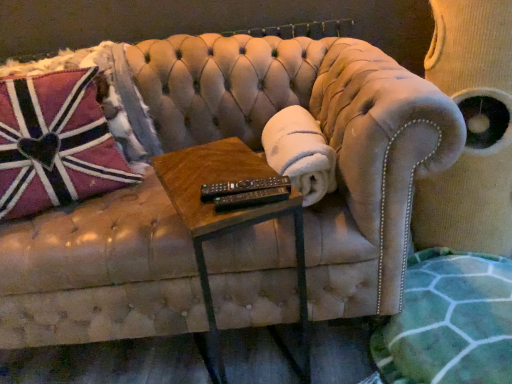
I want to click on black plastic remote at center, so click(242, 187).

What do you see at coordinates (231, 222) in the screenshot? The image size is (512, 384). I see `woodenmaterial/texturetable at center` at bounding box center [231, 222].

What do you see at coordinates (471, 130) in the screenshot?
I see `velvet swivel chair at upper right` at bounding box center [471, 130].

In order to face white fluffy blanket at center, should I rotate leftwards or rightwards?

Turn right approximately 5.311 degrees to face it.

Find the location of a particular element. black plastic remote at center is located at coordinates click(242, 187).

I want to click on swivel chair that is on the right side of pink plush pillow at left, so click(471, 130).

How many degrees apart are the facing directions of velvet swivel chair at upper right and pink plush pillow at left?

The angular difference between velvet swivel chair at upper right and pink plush pillow at left is 8.19 degrees.

From a real-world perspective, is velvet swivel chair at upper right positioned under pink plush pillow at left based on gravity?

Yes, from a real-world perspective, velvet swivel chair at upper right is below pink plush pillow at left.

Which point is more distant from viewer, [266,189] or [269,164]?

The point [269,164] is behind.

Considering the relative positions of black plastic remote at center and white fluffy blanket at center in the image provided, is black plastic remote at center in front of white fluffy blanket at center?

Yes, the depth of black plastic remote at center is less than that of white fluffy blanket at center.

Can you tell me how much black plastic remote at center and white fluffy blanket at center differ in facing direction?

The angle between the facing direction of black plastic remote at center and the facing direction of white fluffy blanket at center is 7.73 degrees.

Which of these two, black plastic remote at center or white fluffy blanket at center, is smaller?

black plastic remote at center.

From a real-world perspective, is black plastic remote at center above or below white fluffy blanket at center?

From a real-world perspective, black plastic remote at center is physically above white fluffy blanket at center.

How many degrees apart are the facing directions of black plastic remote at center and white fluffy blanket at center?

There is a 0.466-degree angle between the facing directions of black plastic remote at center and white fluffy blanket at center.

Does point (221, 185) lie behind point (330, 180)?

No, (221, 185) is in front of (330, 180).

Is black plastic remote at center spatially inside white fluffy blanket at center, or outside of it?

black plastic remote at center lies outside white fluffy blanket at center.

Is point (476, 222) farther from viewer compared to point (276, 192)?

Yes, point (476, 222) is farther from viewer.

Consider the image. Relative to black plastic remote at center, is velvet swivel chair at upper right in front or behind?

velvet swivel chair at upper right is behind black plastic remote at center.

Identify the location of remote in front of the velvet swivel chair at upper right. This screenshot has height=384, width=512. [x=251, y=198].

From the image's perspective, is velvet swivel chair at upper right on black plastic remote at center?

Yes, from the image's perspective, velvet swivel chair at upper right is over black plastic remote at center.

From the image's perspective, between black plastic remote at center and pink plush pillow at left, who is located below?

black plastic remote at center is shown below in the image.

Between black plastic remote at center and pink plush pillow at left, which one is positioned in front?

black plastic remote at center is in front.

From a real-world perspective, who is located higher, black plastic remote at center or pink plush pillow at left?

black plastic remote at center.

Considering the sizes of black plastic remote at center and pink plush pillow at left in the image, is black plastic remote at center bigger or smaller than pink plush pillow at left?

Clearly, black plastic remote at center is smaller in size than pink plush pillow at left.

Locate an element on the screen. This screenshot has width=512, height=384. swivel chair that is on the right side of white fluffy blanket at center is located at coordinates (471, 130).

From a real-world perspective, which object rests below the other?

In real-world perspective, velvet swivel chair at upper right is lower.

From the image's perspective, does white fluffy blanket at center appear lower than velvet swivel chair at upper right?

Yes.

Between pink plush pillow at left and white fluffy blanket at center, which one is positioned behind?

Positioned behind is pink plush pillow at left.

Who is shorter, pink plush pillow at left or white fluffy blanket at center?

white fluffy blanket at center.

Which is in front, point (4, 156) or point (318, 152)?

The point (318, 152) is more forward.

Does pink plush pillow at left have a lesser width compared to white fluffy blanket at center?

In fact, pink plush pillow at left might be wider than white fluffy blanket at center.

Find the location of a particular element. throw pillow above the velvet swivel chair at upper right (from a real-world perspective) is located at coordinates (55, 144).

The height and width of the screenshot is (384, 512). In order to click on material behind the black plastic remote at center in this screenshot , I will do `click(300, 153)`.

When comparing their distances from black plastic remote at center, does green textured blanket at lower right or black plastic remote at center seem further?

green textured blanket at lower right is positioned further to the anchor black plastic remote at center.

Based on their spatial positions, is velvet swivel chair at upper right or woodenmaterial/texturetable at center closer to black plastic remote at center?

woodenmaterial/texturetable at center.

Based on their spatial positions, is woodenmaterial/texturetable at center or black plastic remote at center further from black plastic remote at center?

woodenmaterial/texturetable at center is positioned further to the anchor black plastic remote at center.

Based on their spatial positions, is white fluffy blanket at center or woodenmaterial/texturetable at center closer to velvet swivel chair at upper right?

white fluffy blanket at center.

Looking at the image, which one is located further to velvet swivel chair at upper right, black plastic remote at center or green textured blanket at lower right?

black plastic remote at center.

Estimate the real-world distances between objects in this image. Which object is closer to green textured blanket at lower right, velvet swivel chair at upper right or black plastic remote at center?

The object closer to green textured blanket at lower right is velvet swivel chair at upper right.

Considering their positions, is white fluffy blanket at center positioned further to black plastic remote at center than pink plush pillow at left?

Based on the image, pink plush pillow at left appears to be further to black plastic remote at center.

Considering their positions, is green textured blanket at lower right positioned further to pink plush pillow at left than velvet swivel chair at upper right?

The object further to pink plush pillow at left is velvet swivel chair at upper right.

This screenshot has height=384, width=512. Identify the location of blanket situated between white fluffy blanket at center and velvet swivel chair at upper right from left to right. (449, 322).

Locate an element on the screen. control situated between woodenmaterial/texturetable at center and green textured blanket at lower right from left to right is located at coordinates (242, 187).

Locate an element on the screen. control between pink plush pillow at left and velvet swivel chair at upper right is located at coordinates (242, 187).

Locate an element on the screen. This screenshot has width=512, height=384. material between black plastic remote at center and velvet swivel chair at upper right in the horizontal direction is located at coordinates (300, 153).